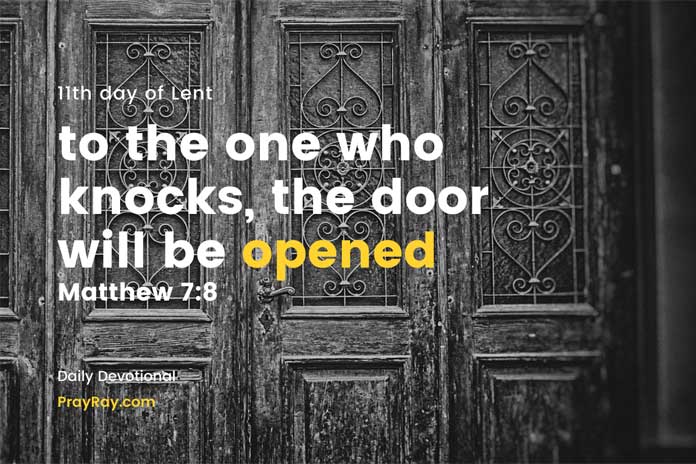
Identify the location of side panels. click(x=26, y=160), click(x=539, y=216).